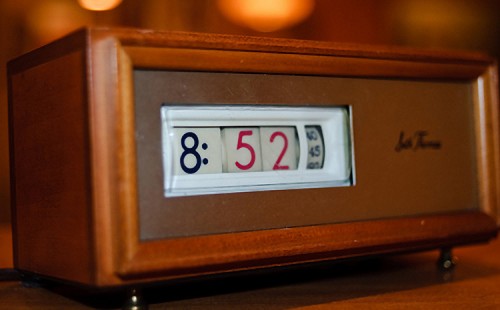
Where is `wooden surface`? This screenshot has width=500, height=310. wooden surface is located at coordinates (407, 300).